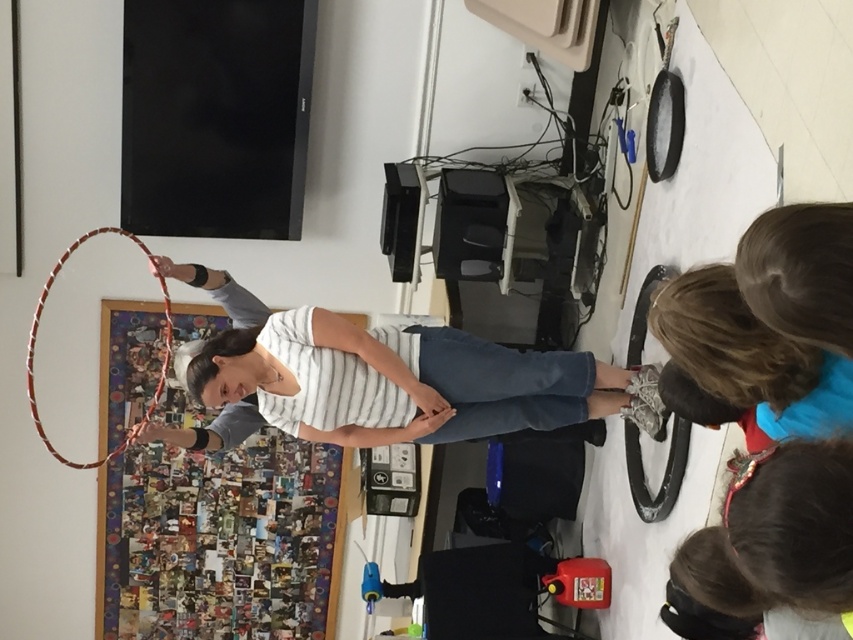
You are a photographer trying to capture a photo of the white striped shirt at center and the smooth brown hair at lower right. Which object should you focus on first if you want to ensure both are in focus without adjusting the camera settings?

The white striped shirt at center is wider than the smooth brown hair at lower right, so focusing on the wider object first would help maintain focus on both.

You are standing in the room where the white striped shirt at center and the multicolored woven hoop at center are present. From your perspective, which object is closer to you?

The white striped shirt at center is closer to you because it is in front of the multicolored woven hoop at center.